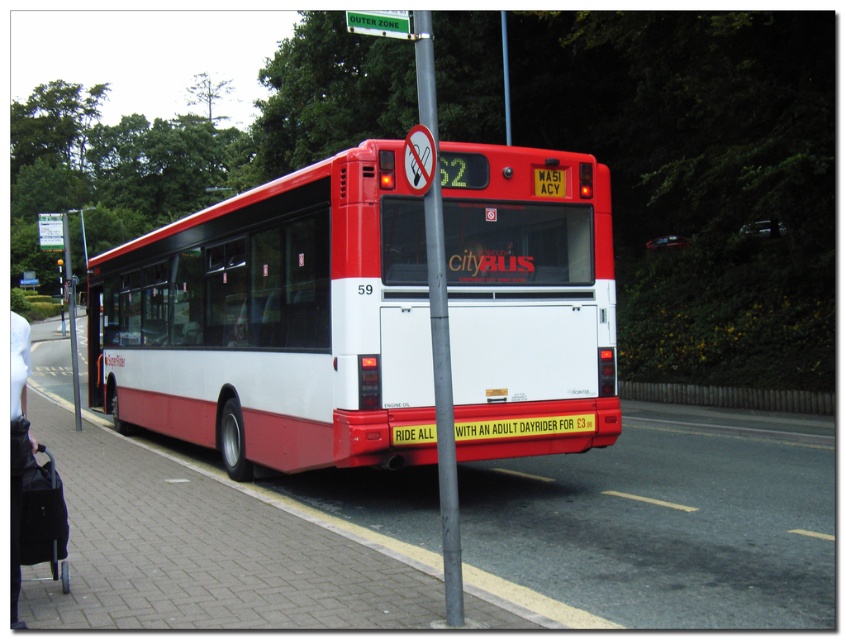
Question: Considering the real-world distances, which object is farthest from the metallic gray pole at center?

Choices:
 (A) green plastic sign at upper center
 (B) yellowtexturedlicense plate at center
 (C) red matte bus at center

Answer: (C)

Question: Is red matte bus at center further to camera compared to metallic gray pole at center?

Choices:
 (A) yes
 (B) no

Answer: (A)

Question: Where is brick pavement at lower left located in relation to metallic gray pole at center in the image?

Choices:
 (A) above
 (B) below

Answer: (B)

Question: Which is farther from the green plastic sign at upper center?

Choices:
 (A) brick pavement at lower left
 (B) metallic gray pole at center

Answer: (A)

Question: Is brick pavement at lower left bigger than metallic gray pole at center?

Choices:
 (A) yes
 (B) no

Answer: (A)

Question: Among these objects, which one is nearest to the camera?

Choices:
 (A) green plastic sign at upper center
 (B) yellowtexturedlicense plate at center

Answer: (A)